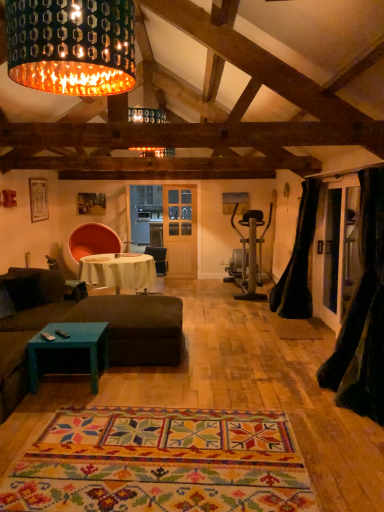
In order to face brown fabric couch at lower left, should I rotate leftwards or rightwards?

Rotate your view left by about 24.662°.

Where is `multicolored woven rug at center`? The height and width of the screenshot is (512, 384). multicolored woven rug at center is located at coordinates coord(160,463).

This screenshot has width=384, height=512. What are the coordinates of `teal matte coffee table at lower left` in the screenshot? It's located at (70, 347).

Can you tell me how much white cloth-covered table at center and multicolored woven rug at center differ in facing direction?

The facing directions of white cloth-covered table at center and multicolored woven rug at center are 85.5 degrees apart.

Does point (94, 268) come behind point (141, 436)?

Yes, it is.

Who is shorter, white cloth-covered table at center or multicolored woven rug at center?

Standing shorter between the two is multicolored woven rug at center.

From the picture: Considering the relative positions of white cloth-covered table at center and multicolored woven rug at center in the image provided, is white cloth-covered table at center to the left of multicolored woven rug at center from the viewer's perspective?

Yes, white cloth-covered table at center is to the left of multicolored woven rug at center.

Is metallic perforated shade at upper center in contact with teal matte coffee table at lower left?

No, metallic perforated shade at upper center is not in contact with teal matte coffee table at lower left.

Which object is positioned more to the left, metallic perforated shade at upper center or teal matte coffee table at lower left?

teal matte coffee table at lower left.

Between metallic perforated shade at upper center and teal matte coffee table at lower left, which one has more height?

metallic perforated shade at upper center is taller.

At what (x,y) coordinates should I click in order to perform the action: click on coffee table behind the metallic perforated shade at upper center. Please return your answer as a coordinate pair (x, y). Looking at the image, I should click on (70, 347).

From a real-world perspective, is metallic perforated shade at upper center located higher than white cloth-covered table at center?

Yes, from a real-world perspective, metallic perforated shade at upper center is above white cloth-covered table at center.

Is metallic perforated shade at upper center positioned far away from white cloth-covered table at center?

That's right, there is a large distance between metallic perforated shade at upper center and white cloth-covered table at center.

Does metallic perforated shade at upper center contain white cloth-covered table at center?

No, metallic perforated shade at upper center does not contain white cloth-covered table at center.

Between black velvet curtain at right, arranged as the 1th curtain when viewed from the front, and dark brown fabric couch at center, which one has more height?

black velvet curtain at right, arranged as the 1th curtain when viewed from the front, is taller.

Is dark brown fabric couch at center at the back of black velvet curtain at right, arranged as the 1th curtain when viewed from the front?

No, dark brown fabric couch at center is not at the back of black velvet curtain at right, arranged as the 1th curtain when viewed from the front.

Where is `studio couch on the left of black velvet curtain at right, arranged as the 1th curtain when viewed from the front`? The image size is (384, 512). studio couch on the left of black velvet curtain at right, arranged as the 1th curtain when viewed from the front is located at coordinates (86, 321).

Between black velvet curtain at right, arranged as the 2th curtain when viewed from the back, and dark brown fabric couch at center, which one is positioned behind?

black velvet curtain at right, arranged as the 2th curtain when viewed from the back.

Based on their sizes in the image, would you say black velvet curtain at right, arranged as the 1th curtain when viewed from the front, is bigger or smaller than white cloth-covered table at center?

Clearly, black velvet curtain at right, arranged as the 1th curtain when viewed from the front, is smaller in size than white cloth-covered table at center.

Is black velvet curtain at right, arranged as the 2th curtain when viewed from the back, oriented away from white cloth-covered table at center?

black velvet curtain at right, arranged as the 2th curtain when viewed from the back, does not have its back to white cloth-covered table at center.

Is black velvet curtain at right, arranged as the 1th curtain when viewed from the front, shorter than white cloth-covered table at center?

In fact, black velvet curtain at right, arranged as the 1th curtain when viewed from the front, may be taller than white cloth-covered table at center.

Considering the sizes of objects metallic perforated shade at upper center and multicolored woven rug at center in the image provided, who is shorter, metallic perforated shade at upper center or multicolored woven rug at center?

Standing shorter between the two is multicolored woven rug at center.

Who is more distant, metallic perforated shade at upper center or multicolored woven rug at center?

Positioned behind is multicolored woven rug at center.

Is multicolored woven rug at center located within metallic perforated shade at upper center?

No, multicolored woven rug at center is not inside metallic perforated shade at upper center.

Which is behind, point (128, 46) or point (228, 411)?

The point (228, 411) is farther from the camera.

Between brown fabric couch at lower left and black fabric guitar case at right, the 1th curtain in the back-to-front sequence, which one has less height?

With less height is brown fabric couch at lower left.

Consider the image. Which of these two, brown fabric couch at lower left or black fabric guitar case at right, which is counted as the second curtain, starting from the front, is bigger?

Bigger between the two is brown fabric couch at lower left.

Based on their positions, is brown fabric couch at lower left located to the left or right of black fabric guitar case at right, which is counted as the second curtain, starting from the front?

Based on their positions, brown fabric couch at lower left is located to the left of black fabric guitar case at right, which is counted as the second curtain, starting from the front.

How far apart are brown fabric couch at lower left and black fabric guitar case at right, which is counted as the second curtain, starting from the front?

brown fabric couch at lower left and black fabric guitar case at right, which is counted as the second curtain, starting from the front, are 3.13 meters apart from each other.

Identify the location of mat that is on the right side of white cloth-covered table at center. This screenshot has height=512, width=384. (160, 463).

Locate an element on the screen. The image size is (384, 512). coffee table on the left side of metallic perforated shade at upper center is located at coordinates (70, 347).

Which object lies further to the anchor point metallic perforated shade at upper center, black velvet curtain at right, arranged as the 1th curtain when viewed from the front, or white cloth-covered table at center?

white cloth-covered table at center is positioned further to the anchor metallic perforated shade at upper center.

Estimate the real-world distances between objects in this image. Which object is closer to black velvet curtain at right, arranged as the 2th curtain when viewed from the back, metallic perforated shade at upper center or dark brown fabric couch at center?

Among the two, dark brown fabric couch at center is located nearer to black velvet curtain at right, arranged as the 2th curtain when viewed from the back.

Estimate the real-world distances between objects in this image. Which object is further from metallic perforated shade at upper center, white cloth-covered table at center or brown fabric couch at lower left?

white cloth-covered table at center is positioned further to the anchor metallic perforated shade at upper center.

Estimate the real-world distances between objects in this image. Which object is further from dark brown fabric couch at center, teal matte coffee table at lower left or metallic perforated shade at upper center?

metallic perforated shade at upper center is further to dark brown fabric couch at center.

Looking at the image, which one is located further to black velvet curtain at right, arranged as the 2th curtain when viewed from the back, brown fabric couch at lower left or metallic perforated shade at upper center?

brown fabric couch at lower left is positioned further to the anchor black velvet curtain at right, arranged as the 2th curtain when viewed from the back.

When comparing their distances from black fabric guitar case at right, the 1th curtain in the back-to-front sequence, does black velvet curtain at right, arranged as the 1th curtain when viewed from the front, or white cloth-covered table at center seem closer?

Among the two, black velvet curtain at right, arranged as the 1th curtain when viewed from the front, is located nearer to black fabric guitar case at right, the 1th curtain in the back-to-front sequence.

From the image, which object appears to be farther from teal matte coffee table at lower left, white cloth-covered table at center or multicolored woven rug at center?

white cloth-covered table at center is positioned further to the anchor teal matte coffee table at lower left.

Looking at the image, which one is located closer to brown fabric couch at lower left, metallic perforated shade at upper center or dark brown fabric couch at center?

dark brown fabric couch at center.

Locate an element on the screen. The image size is (384, 512). studio couch between metallic perforated shade at upper center and teal matte coffee table at lower left in the vertical direction is located at coordinates (86, 321).

What are the coordinates of `couch located between dark brown fabric couch at center and black fabric guitar case at right, which is counted as the second curtain, starting from the front, in the depth direction` in the screenshot? It's located at (28, 324).

At what (x,y) coordinates should I click in order to perform the action: click on coffee table located between dark brown fabric couch at center and white cloth-covered table at center in the depth direction. Please return your answer as a coordinate pair (x, y). The height and width of the screenshot is (512, 384). Looking at the image, I should click on (70, 347).

Where is `mat between dark brown fabric couch at center and teal matte coffee table at lower left along the z-axis`? mat between dark brown fabric couch at center and teal matte coffee table at lower left along the z-axis is located at coordinates (160, 463).